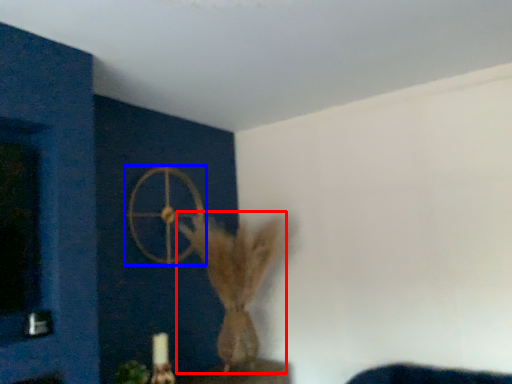
Question: Which of the following is the farthest to the observer, animal (highlighted by a red box) or wheel (highlighted by a blue box)?

Choices:
 (A) animal
 (B) wheel

Answer: (B)